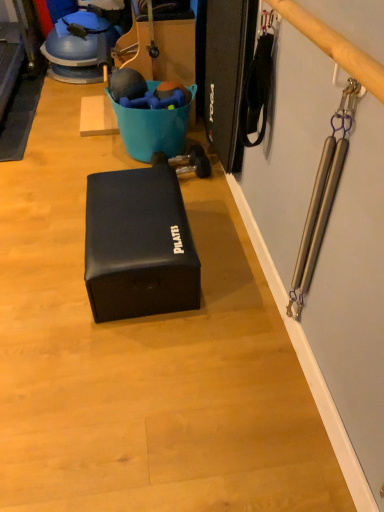
Where is `free spot above black leather box at center (from a real-world perspective)`? This screenshot has width=384, height=512. free spot above black leather box at center (from a real-world perspective) is located at coordinates (139, 206).